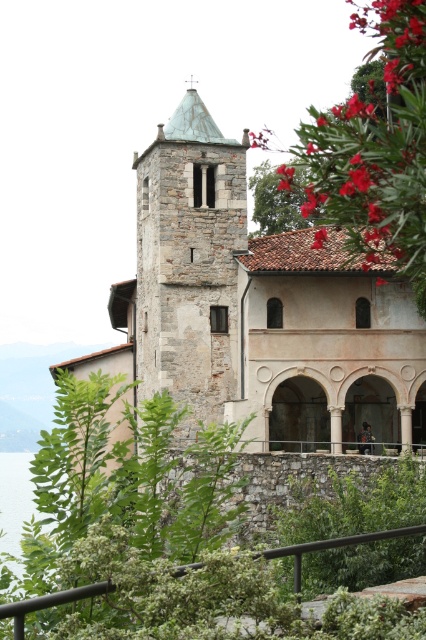
You are a photographer planning to capture the stone tower at center and the transparent water at lower left in a single frame. Based on their visual presence in the image, which object should you focus on to ensure both are adequately represented in the photo?

The transparent water at lower left occupies more space than the stone tower at center, so focusing on the transparent water at lower left would ensure both are adequately represented in the photo.

You are a visitor standing in the garden and want to take a photo that includes both the stone tower at center and the transparent water at lower left. Which object will appear wider in the photo?

The transparent water at lower left will appear wider in the photo since the stone tower at center is narrower than it.